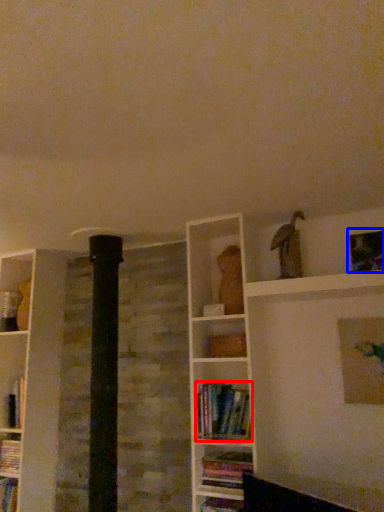
Question: Which object appears farthest to the camera in this image, book (highlighted by a red box) or picture frame (highlighted by a blue box)?

Choices:
 (A) book
 (B) picture frame

Answer: (B)